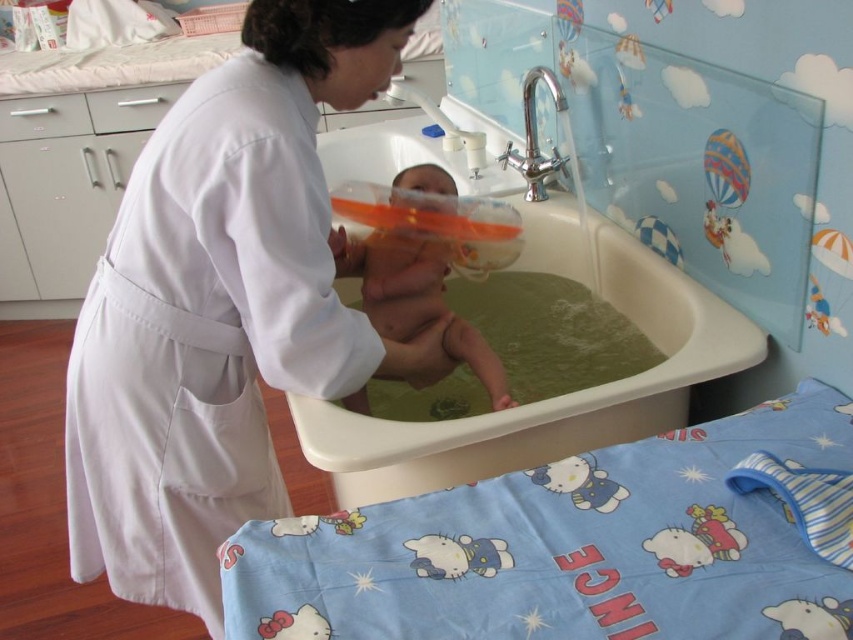
Question: Estimate the real-world distances between objects in this image. Which object is farther from the green plastic bath at center?

Choices:
 (A) white matte uniform at center
 (B) smooth orange rubber tub at center

Answer: (B)

Question: Does green plastic bath at center appear on the left side of smooth orange rubber tub at center?

Choices:
 (A) no
 (B) yes

Answer: (A)

Question: Estimate the real-world distances between objects in this image. Which object is closer to the green plastic bath at center?

Choices:
 (A) smooth orange rubber tub at center
 (B) white matte uniform at center

Answer: (B)

Question: Which of these objects is positioned closest to the green plastic bath at center?

Choices:
 (A) smooth orange rubber tub at center
 (B) white matte uniform at center

Answer: (B)

Question: Is white matte uniform at center above green plastic bath at center?

Choices:
 (A) no
 (B) yes

Answer: (B)

Question: Is white matte uniform at center behind green plastic bath at center?

Choices:
 (A) no
 (B) yes

Answer: (A)